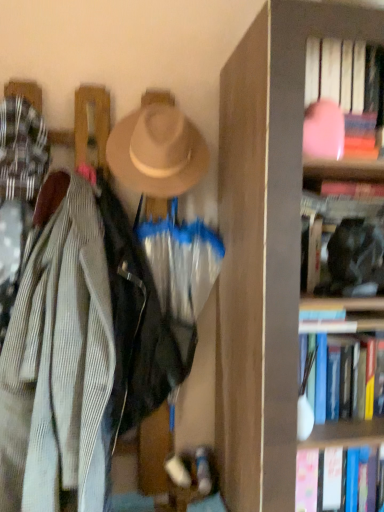
This screenshot has height=512, width=384. Identify the location of wooden bookcase at right. (265, 245).

This screenshot has width=384, height=512. What do you see at coordinates (338, 378) in the screenshot? I see `hardcover book at right, which is the 1th book in bottom-to-top order` at bounding box center [338, 378].

Locate an element on the screen. pink matte book at upper right, which ranks as the third book in bottom-to-top order is located at coordinates (x=341, y=101).

Between black matte bookshelf at upper right, the 2th book from the top, and hardcover book at right, which is the 1th book in bottom-to-top order, which one appears on the right side from the viewer's perspective?

black matte bookshelf at upper right, the 2th book from the top.

Could you tell me if black matte bookshelf at upper right, the second book when ordered from bottom to top, is turned towards hardcover book at right, which is the 1th book in bottom-to-top order?

No, black matte bookshelf at upper right, the second book when ordered from bottom to top, is not aimed at hardcover book at right, which is the 1th book in bottom-to-top order.

Which object is closer to the camera, black matte bookshelf at upper right, the second book when ordered from bottom to top, or hardcover book at right, which is the 1th book in bottom-to-top order?

hardcover book at right, which is the 1th book in bottom-to-top order.

Considering the sizes of objects black matte bookshelf at upper right, the second book when ordered from bottom to top, and hardcover book at right, positioned as the third book in top-to-bottom order, in the image provided, who is wider, black matte bookshelf at upper right, the second book when ordered from bottom to top, or hardcover book at right, positioned as the third book in top-to-bottom order,?

With larger width is hardcover book at right, positioned as the third book in top-to-bottom order.

From a real-world perspective, between hardcover book at right, which is the 1th book in bottom-to-top order, and beige felt hat at upper center, who is vertically lower?

From a 3D spatial view, hardcover book at right, which is the 1th book in bottom-to-top order, is below.

Is point (358, 394) positioned behind point (202, 137)?

That is False.

Looking at this image, considering the sizes of objects hardcover book at right, positioned as the third book in top-to-bottom order, and beige felt hat at upper center in the image provided, who is taller, hardcover book at right, positioned as the third book in top-to-bottom order, or beige felt hat at upper center?

beige felt hat at upper center is taller.

From a real-world perspective, which is physically above, hardcover book at right, which is the 1th book in bottom-to-top order, or black matte bookshelf at upper right, the 2th book from the top?

black matte bookshelf at upper right, the 2th book from the top, from a real-world perspective.

Are hardcover book at right, which is the 1th book in bottom-to-top order, and black matte bookshelf at upper right, the second book when ordered from bottom to top, far apart?

They are positioned close to each other.

Based on the photo, who is bigger, hardcover book at right, positioned as the third book in top-to-bottom order, or black matte bookshelf at upper right, the second book when ordered from bottom to top?

With larger size is hardcover book at right, positioned as the third book in top-to-bottom order.

Is hardcover book at right, positioned as the third book in top-to-bottom order, facing towards black matte bookshelf at upper right, the 2th book from the top?

No, hardcover book at right, positioned as the third book in top-to-bottom order, is not facing towards black matte bookshelf at upper right, the 2th book from the top.

Is pink matte book at upper right, the first book in the top-to-bottom sequence, taller than black matte bookshelf at upper right, the second book when ordered from bottom to top?

No.

Is pink matte book at upper right, the first book in the top-to-bottom sequence, not inside black matte bookshelf at upper right, the second book when ordered from bottom to top?

Absolutely, pink matte book at upper right, the first book in the top-to-bottom sequence, is external to black matte bookshelf at upper right, the second book when ordered from bottom to top.

There is a black matte bookshelf at upper right, the second book when ordered from bottom to top. Where is `book above it (from a real-world perspective)`? Image resolution: width=384 pixels, height=512 pixels. book above it (from a real-world perspective) is located at coordinates (341, 101).

Is pink matte book at upper right, which ranks as the third book in bottom-to-top order, in front of or behind black matte bookshelf at upper right, the second book when ordered from bottom to top, in the image?

Clearly, pink matte book at upper right, which ranks as the third book in bottom-to-top order, is in front of black matte bookshelf at upper right, the second book when ordered from bottom to top.

Is black matte bookshelf at upper right, the 2th book from the top, taller than wooden bookcase at right?

No.

Is wooden bookcase at right inside black matte bookshelf at upper right, the 2th book from the top?

No, wooden bookcase at right is located outside of black matte bookshelf at upper right, the 2th book from the top.

Who is smaller, black matte bookshelf at upper right, the 2th book from the top, or wooden bookcase at right?

Smaller between the two is black matte bookshelf at upper right, the 2th book from the top.

From the image's perspective, is pink matte book at upper right, which ranks as the third book in bottom-to-top order, located beneath beige felt hat at upper center?

Incorrect, from the image's perspective, pink matte book at upper right, which ranks as the third book in bottom-to-top order, is higher than beige felt hat at upper center.

Who is taller, pink matte book at upper right, which ranks as the third book in bottom-to-top order, or beige felt hat at upper center?

With more height is beige felt hat at upper center.

In the scene shown: Would you say beige felt hat at upper center is part of pink matte book at upper right, which ranks as the third book in bottom-to-top order,'s contents?

No, pink matte book at upper right, which ranks as the third book in bottom-to-top order, does not contain beige felt hat at upper center.

Where is `the 2nd book behind the wooden bookcase at right, counting from the anchor's position`? the 2nd book behind the wooden bookcase at right, counting from the anchor's position is located at coordinates (338, 378).

Considering the positions of point (351, 392) and point (247, 492), is point (351, 392) closer or farther from the camera than point (247, 492)?

Point (351, 392) appears to be farther away from the viewer than point (247, 492).

Does hardcover book at right, positioned as the third book in top-to-bottom order, have a greater height compared to wooden bookcase at right?

No, hardcover book at right, positioned as the third book in top-to-bottom order, is not taller than wooden bookcase at right.

Where is `book that appears below the black matte bookshelf at upper right, the second book when ordered from bottom to top (from a real-world perspective)`? The height and width of the screenshot is (512, 384). book that appears below the black matte bookshelf at upper right, the second book when ordered from bottom to top (from a real-world perspective) is located at coordinates (338, 378).

Where is `the 1st book in front of the beige felt hat at upper center`? The width and height of the screenshot is (384, 512). the 1st book in front of the beige felt hat at upper center is located at coordinates (338, 378).

Considering their positions, is black matte bookshelf at upper right, the second book when ordered from bottom to top, positioned further to beige felt hat at upper center than wooden bookcase at right?

The object further to beige felt hat at upper center is black matte bookshelf at upper right, the second book when ordered from bottom to top.

From the image, which object appears to be nearer to black matte bookshelf at upper right, the second book when ordered from bottom to top, hardcover book at right, positioned as the third book in top-to-bottom order, or pink matte book at upper right, the first book in the top-to-bottom sequence?

pink matte book at upper right, the first book in the top-to-bottom sequence, lies closer to black matte bookshelf at upper right, the second book when ordered from bottom to top, than the other object.

In the scene shown: Estimate the real-world distances between objects in this image. Which object is closer to hardcover book at right, positioned as the third book in top-to-bottom order, black matte bookshelf at upper right, the second book when ordered from bottom to top, or pink matte book at upper right, which ranks as the third book in bottom-to-top order?

Among the two, black matte bookshelf at upper right, the second book when ordered from bottom to top, is located nearer to hardcover book at right, positioned as the third book in top-to-bottom order.

From the image, which object appears to be farther from beige felt hat at upper center, hardcover book at right, positioned as the third book in top-to-bottom order, or wooden bookcase at right?

Based on the image, hardcover book at right, positioned as the third book in top-to-bottom order, appears to be further to beige felt hat at upper center.

Estimate the real-world distances between objects in this image. Which object is closer to pink matte book at upper right, the first book in the top-to-bottom sequence, hardcover book at right, positioned as the third book in top-to-bottom order, or wooden bookcase at right?

The object closer to pink matte book at upper right, the first book in the top-to-bottom sequence, is wooden bookcase at right.

Estimate the real-world distances between objects in this image. Which object is further from beige felt hat at upper center, pink matte book at upper right, the first book in the top-to-bottom sequence, or hardcover book at right, which is the 1th book in bottom-to-top order?

hardcover book at right, which is the 1th book in bottom-to-top order.

Considering their positions, is wooden bookcase at right positioned further to hardcover book at right, which is the 1th book in bottom-to-top order, than black matte bookshelf at upper right, the 2th book from the top?

The object further to hardcover book at right, which is the 1th book in bottom-to-top order, is wooden bookcase at right.

When comparing their distances from hardcover book at right, which is the 1th book in bottom-to-top order, does black matte bookshelf at upper right, the second book when ordered from bottom to top, or beige felt hat at upper center seem closer?

Among the two, black matte bookshelf at upper right, the second book when ordered from bottom to top, is located nearer to hardcover book at right, which is the 1th book in bottom-to-top order.

I want to click on bookcase situated between beige felt hat at upper center and black matte bookshelf at upper right, the second book when ordered from bottom to top, from left to right, so click(265, 245).

Identify the location of bookcase that lies between black matte bookshelf at upper right, the 2th book from the top, and hardcover book at right, positioned as the third book in top-to-bottom order, from top to bottom. (265, 245).

Locate an element on the screen. This screenshot has width=384, height=512. book between beige felt hat at upper center and hardcover book at right, positioned as the third book in top-to-bottom order, in the up-down direction is located at coordinates (347, 243).

Identify the location of book between pink matte book at upper right, the first book in the top-to-bottom sequence, and hardcover book at right, positioned as the third book in top-to-bottom order, in the vertical direction. (347, 243).